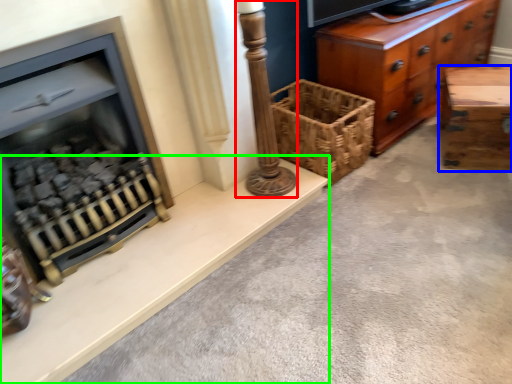
Question: Based on their relative distances, which object is farther from pillar (highlighted by a red box)? Choose from table (highlighted by a blue box) and ledge (highlighted by a green box).

Choices:
 (A) table
 (B) ledge

Answer: (A)